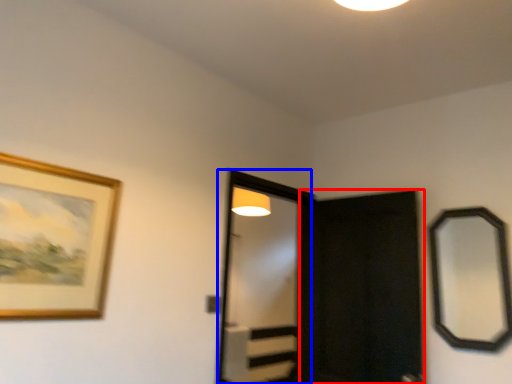
Question: Which object is closer to the camera taking this photo, screen door (highlighted by a red box) or screen door (highlighted by a blue box)?

Choices:
 (A) screen door
 (B) screen door

Answer: (A)